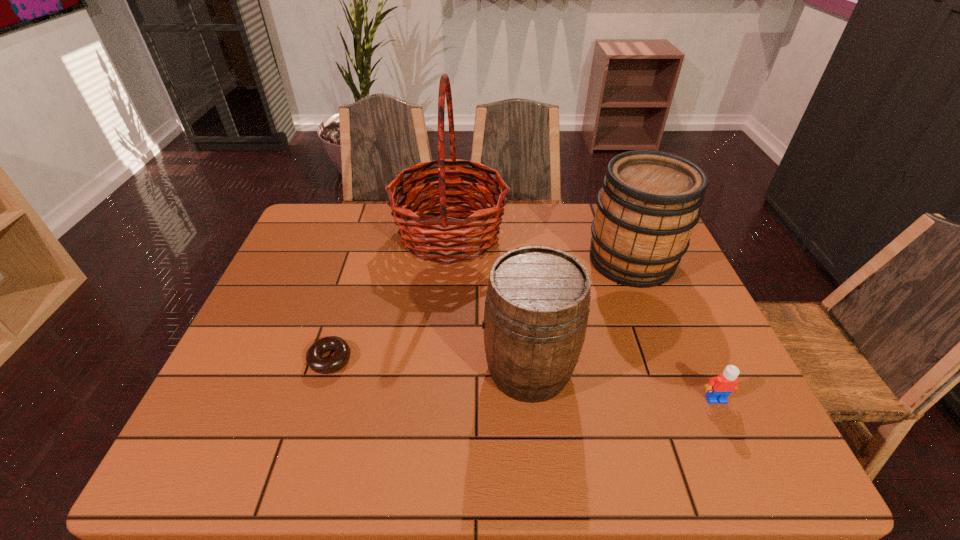
In the image, there is a desktop. Where is `free space at the left edge`? This screenshot has height=540, width=960. free space at the left edge is located at coordinates (292, 281).

In the image, there is a desktop. Where is `free region at the right edge`? The image size is (960, 540). free region at the right edge is located at coordinates (636, 296).

The height and width of the screenshot is (540, 960). In the image, there is a desktop. What are the coordinates of `free space at the near right corner` in the screenshot? It's located at (693, 435).

Find the location of a particular element. This screenshot has height=540, width=960. vacant space in between the doughnut and the left cider is located at coordinates (429, 364).

Locate an element on the screen. free space between the shortest object and the left cider is located at coordinates (429, 364).

Where is `free space between the doughnut and the farther cider`? free space between the doughnut and the farther cider is located at coordinates (481, 310).

Find the location of a particular element. This screenshot has height=540, width=960. vacant area that lies between the Lego and the farther cider is located at coordinates (674, 329).

This screenshot has width=960, height=540. I want to click on empty space between the basket and the doughnut, so click(x=390, y=297).

The image size is (960, 540). What are the coordinates of `vacant area that lies between the left cider and the doughnut` in the screenshot? It's located at (429, 364).

The height and width of the screenshot is (540, 960). I want to click on free spot between the second shortest object and the nearer cider, so click(x=622, y=384).